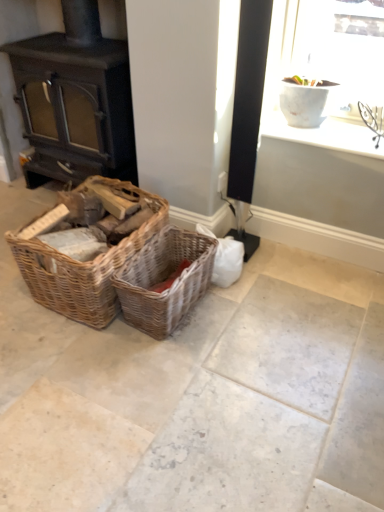
Question: From the image's perspective, is woven wood basket at left, the second picnic basket in the right-to-left sequence, positioned above or below woven brown picnic basket at center, the 1th picnic basket positioned from the right?

Choices:
 (A) below
 (B) above

Answer: (B)

Question: Choose the correct answer: Is woven wood basket at left, the second picnic basket in the right-to-left sequence, inside woven brown picnic basket at center, placed as the second picnic basket when sorted from left to right, or outside it?

Choices:
 (A) outside
 (B) inside

Answer: (A)

Question: Which is nearer to the woven brown picnic basket at center, placed as the second picnic basket when sorted from left to right?

Choices:
 (A) white ceramic vase at upper right
 (B) woven wood basket at left, the second picnic basket in the right-to-left sequence
 (C) matte black wood burning stove at left

Answer: (B)

Question: Which object is positioned farthest from the white ceramic vase at upper right?

Choices:
 (A) matte black wood burning stove at left
 (B) woven brown picnic basket at center, the 1th picnic basket positioned from the right
 (C) woven wood basket at left, the 1th picnic basket when ordered from left to right

Answer: (A)